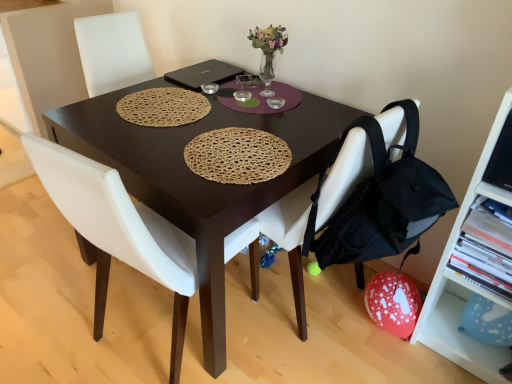
Identify the location of free space in front of black matte laptop at center. The width and height of the screenshot is (512, 384). (189, 95).